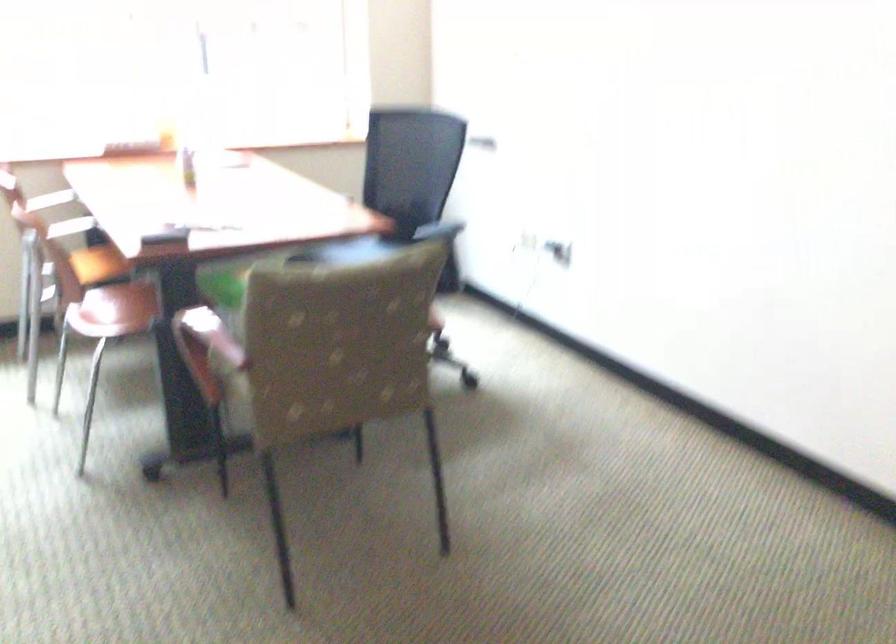
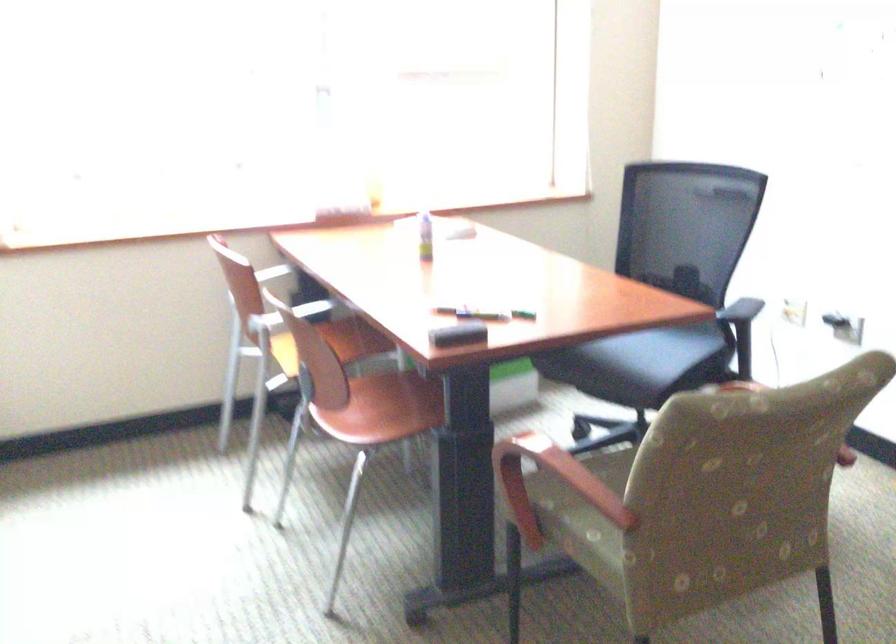
Which direction would the cameraman need to move to produce the second image?

The cameraman walked toward left, forward.